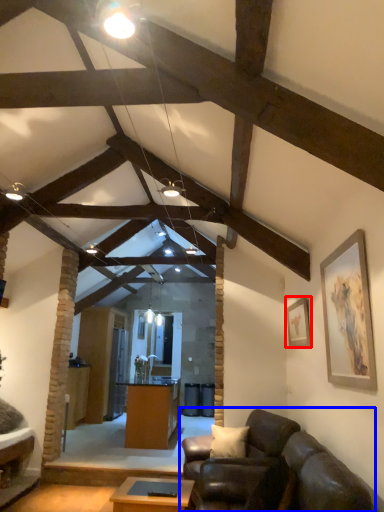
Question: Which of the following is the closest to the observer, picture frame (highlighted by a red box) or studio couch (highlighted by a blue box)?

Choices:
 (A) picture frame
 (B) studio couch

Answer: (B)